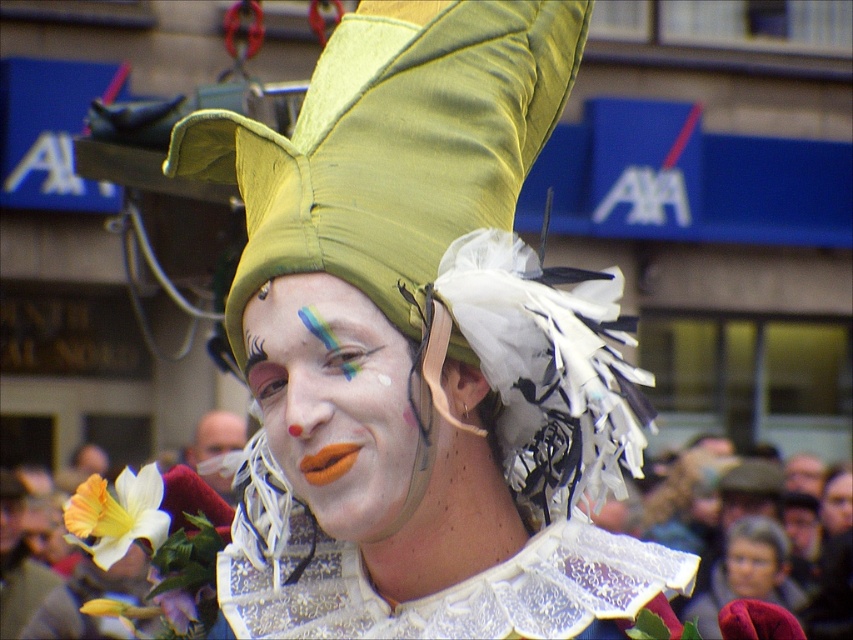
Consider the image. Is matte green hat at center below matte white face paint at center?

No.

Can you confirm if matte green hat at center is shorter than matte white face paint at center?

No.

Where is `matte green hat at center`? matte green hat at center is located at coordinates (422, 346).

Can you confirm if matte black face at lower right is smaller than smooth skin face at center?

Indeed, matte black face at lower right has a smaller size compared to smooth skin face at center.

From the picture: Is matte black face at lower right shorter than smooth skin face at center?

No.

The height and width of the screenshot is (640, 853). Identify the location of matte black face at lower right. (751, 566).

Locate an element on the screen. The image size is (853, 640). matte black face at lower right is located at coordinates (751, 566).

Does matte black face at lower right appear over matte white face paint at center?

Actually, matte black face at lower right is below matte white face paint at center.

Can you confirm if matte black face at lower right is taller than matte white face paint at center?

Yes, matte black face at lower right is taller than matte white face paint at center.

Is point (770, 557) positioned after point (212, 424)?

That is False.

Where is `matte black face at lower right`? The width and height of the screenshot is (853, 640). matte black face at lower right is located at coordinates (751, 566).